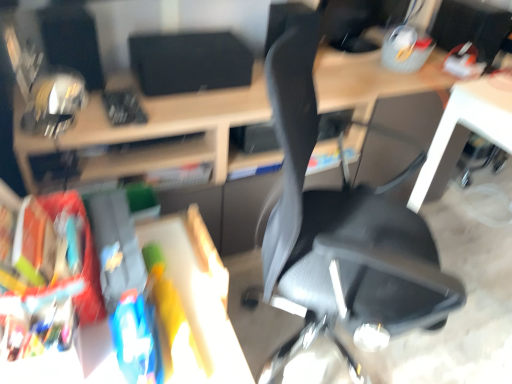
Question: Considering their positions, is black matte speaker at upper center, the first computer monitor from the left, located in front of or behind matte black monitor at upper right, which is the first computer monitor from right to left?

Choices:
 (A) behind
 (B) front

Answer: (B)

Question: Do you think black matte speaker at upper center, the first computer monitor from the left, is within matte black monitor at upper right, which is the first computer monitor from right to left, or outside of it?

Choices:
 (A) inside
 (B) outside

Answer: (B)

Question: Which is farther from the matte black desk at center?

Choices:
 (A) black mesh chair at center
 (B) black matte speaker at upper center, the first computer monitor from the left
 (C) matte black monitor at upper right, which is the first computer monitor from right to left

Answer: (C)

Question: Which is nearer to the matte black desk at center?

Choices:
 (A) black matte speaker at upper center, the first computer monitor from the left
 (B) matte black monitor at upper right, which is counted as the second computer monitor, starting from the left
 (C) black mesh chair at center

Answer: (A)